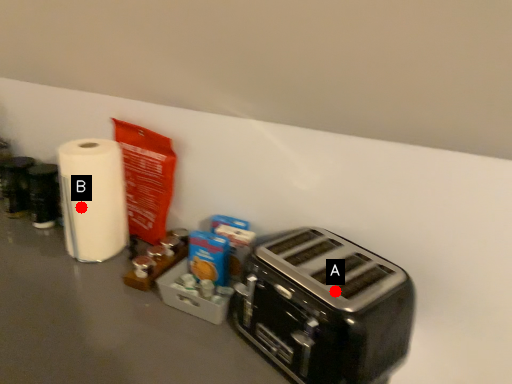
Question: Two points are circled on the image, labeled by A and B beside each circle. Which point is farther from the camera taking this photo?

Choices:
 (A) A is further
 (B) B is further

Answer: (B)